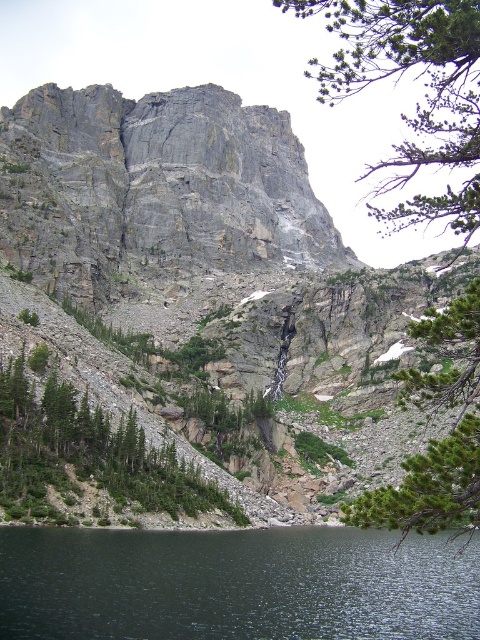
You are a hiker who wants to cross the dark reflective water at lower center to reach the green leafy tree at center. The bridge over the water is 45 meters long. Is the bridge long enough to cross the water?

The distance between the dark reflective water at lower center and the green leafy tree at center is 47.91 meters. The bridge is only 45 meters long, so it is not long enough to cross the water.

You are a hiker standing at the edge of the dark reflective water at lower center looking towards the gray rock mountain at upper center. Which object is closer to you?

The gray rock mountain at upper center is closer to you because it is positioned in front of the dark reflective water at lower center.

You are a hiker standing at the base of the cliff and looking towards the lake. You see two points marked on the image. The first point is at coordinates point (96, 608) and the second point is at point (445, 192). Which point is closer to you?

Point (96, 608) is closer to you because it is in front of point (445, 192).